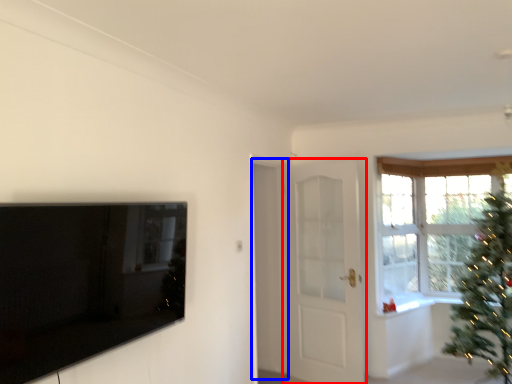
Question: Which object appears farthest to the camera in this image, door (highlighted by a red box) or screen door (highlighted by a blue box)?

Choices:
 (A) door
 (B) screen door

Answer: (A)